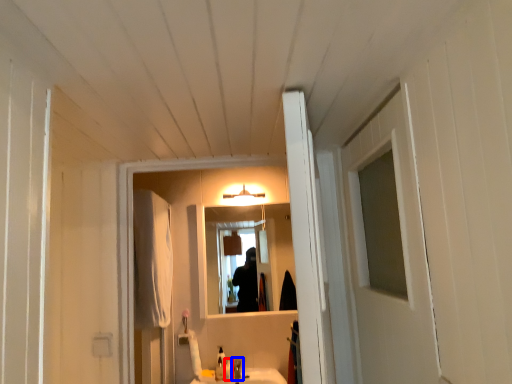
Question: Which object appears closest to the camera in this image, toiletry (highlighted by a red box) or faucet (highlighted by a blue box)?

Choices:
 (A) toiletry
 (B) faucet

Answer: (B)